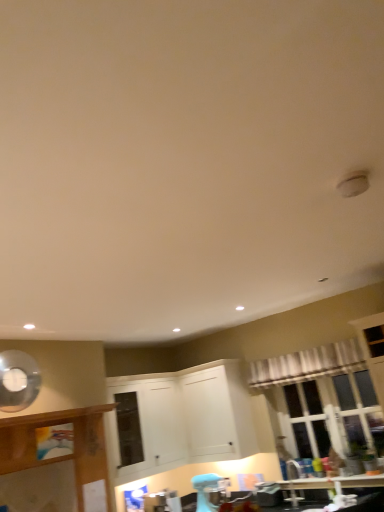
Question: Considering the relative positions of white sheer curtain at upper right and wooden cabinet at left, the 3th cabinetry when ordered from right to left, in the image provided, is white sheer curtain at upper right in front of wooden cabinet at left, the 3th cabinetry when ordered from right to left,?

Choices:
 (A) no
 (B) yes

Answer: (A)

Question: Considering the relative sizes of white sheer curtain at upper right and wooden cabinet at left, the 1th cabinetry from the left, in the image provided, is white sheer curtain at upper right taller than wooden cabinet at left, the 1th cabinetry from the left,?

Choices:
 (A) yes
 (B) no

Answer: (B)

Question: Is white sheer curtain at upper right positioned beyond the bounds of wooden cabinet at left, the 3th cabinetry when ordered from right to left?

Choices:
 (A) no
 (B) yes

Answer: (B)

Question: Can you confirm if white sheer curtain at upper right is positioned to the left of wooden cabinet at left, the 1th cabinetry from the left?

Choices:
 (A) no
 (B) yes

Answer: (A)

Question: Is white sheer curtain at upper right oriented away from wooden cabinet at left, the 1th cabinetry from the left?

Choices:
 (A) yes
 (B) no

Answer: (B)

Question: From the image's perspective, is white sheer curtain at upper right located beneath wooden cabinet at left, the 1th cabinetry from the left?

Choices:
 (A) no
 (B) yes

Answer: (A)

Question: Considering the relative sizes of white matte cabinet at center, the 1th cabinetry in the right-to-left sequence, and white sheer curtain at upper right in the image provided, is white matte cabinet at center, the 1th cabinetry in the right-to-left sequence, taller than white sheer curtain at upper right?

Choices:
 (A) yes
 (B) no

Answer: (A)

Question: Considering the relative sizes of white matte cabinet at center, the 1th cabinetry in the right-to-left sequence, and white sheer curtain at upper right in the image provided, is white matte cabinet at center, the 1th cabinetry in the right-to-left sequence, thinner than white sheer curtain at upper right?

Choices:
 (A) no
 (B) yes

Answer: (A)

Question: Is white matte cabinet at center, the 1th cabinetry in the right-to-left sequence, positioned behind white sheer curtain at upper right?

Choices:
 (A) no
 (B) yes

Answer: (B)

Question: Are white matte cabinet at center, the 1th cabinetry in the right-to-left sequence, and white sheer curtain at upper right far apart?

Choices:
 (A) yes
 (B) no

Answer: (B)

Question: Can you confirm if white matte cabinet at center, the 1th cabinetry in the right-to-left sequence, is positioned to the left of white sheer curtain at upper right?

Choices:
 (A) no
 (B) yes

Answer: (B)

Question: Is white matte cabinet at center, the 1th cabinetry in the right-to-left sequence, wider than white sheer curtain at upper right?

Choices:
 (A) no
 (B) yes

Answer: (B)

Question: Is white matte cabinet at center, which is the 2th cabinetry from right to left, further to the viewer compared to white sheer curtain at upper right?

Choices:
 (A) yes
 (B) no

Answer: (A)